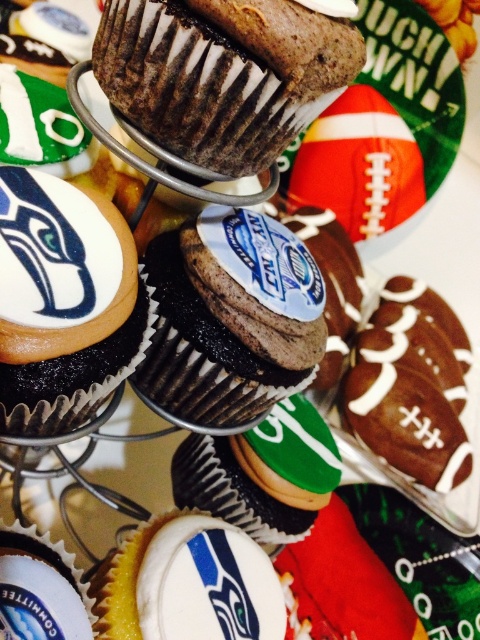
From the picture: Does chocolatesmoothcupcake at center appear under matte chocolate cupcake at center?

Indeed, chocolatesmoothcupcake at center is positioned under matte chocolate cupcake at center.

Between chocolatesmoothcupcake at center and matte chocolate cupcake at center, which one has more height?

chocolatesmoothcupcake at center

I want to click on chocolatesmoothcupcake at center, so click(230, 317).

Is chocolate matte cupcake at center thinner than chocolate frosted cupcake at center?

In fact, chocolate matte cupcake at center might be wider than chocolate frosted cupcake at center.

Who is higher up, chocolate matte cupcake at center or chocolate frosted cupcake at center?

chocolate matte cupcake at center

Find the location of a particular element. chocolate matte cupcake at center is located at coordinates (216, 76).

Is chocolate matte cupcake at center closer to the viewer compared to white glossy cupcake at center?

Yes.

Which is below, chocolate matte cupcake at center or white glossy cupcake at center?

Positioned lower is white glossy cupcake at center.

Is point (206, 4) closer to viewer compared to point (14, 636)?

Yes, it is in front of point (14, 636).

Locate an element on the screen. This screenshot has height=640, width=480. chocolate matte cupcake at center is located at coordinates (216, 76).